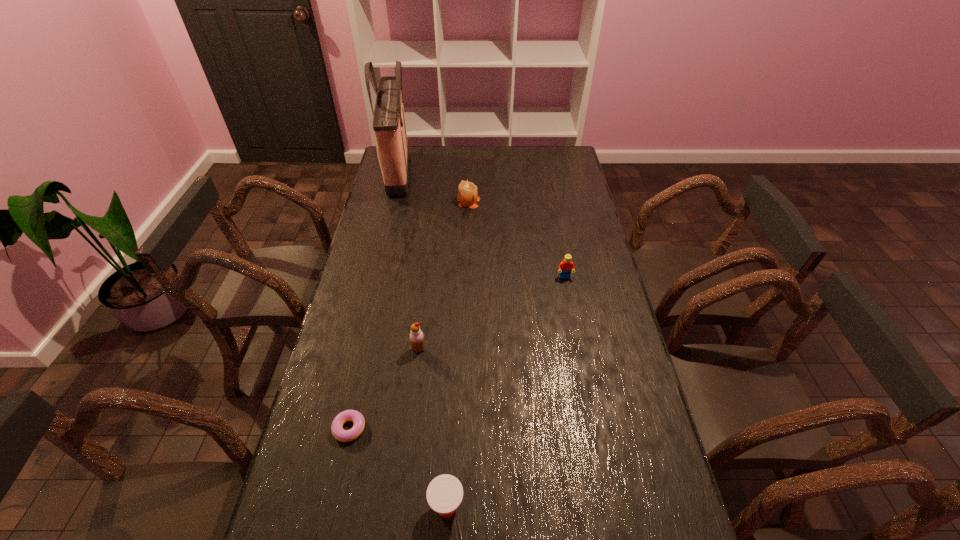
The height and width of the screenshot is (540, 960). Find the location of `blank region between the candle and the tallest object`. blank region between the candle and the tallest object is located at coordinates (433, 187).

The height and width of the screenshot is (540, 960). In order to click on free area in between the candle and the nearest object in this screenshot , I will do `click(458, 354)`.

Locate an element on the screen. vacant point located between the doughnut and the candle is located at coordinates (409, 315).

Locate an element on the screen. This screenshot has height=540, width=960. free space between the fifth farthest object and the candle is located at coordinates (409, 315).

The height and width of the screenshot is (540, 960). Identify the location of the fourth closest object to the Dixie cup. (467, 196).

Where is `object that stands as the third closest to the candle`? The height and width of the screenshot is (540, 960). object that stands as the third closest to the candle is located at coordinates (416, 335).

Where is `vacant point that satisfies the following two spatial constraints: 1. on the back side of the candle; 2. on the right side of the doughnut`? vacant point that satisfies the following two spatial constraints: 1. on the back side of the candle; 2. on the right side of the doughnut is located at coordinates (399, 201).